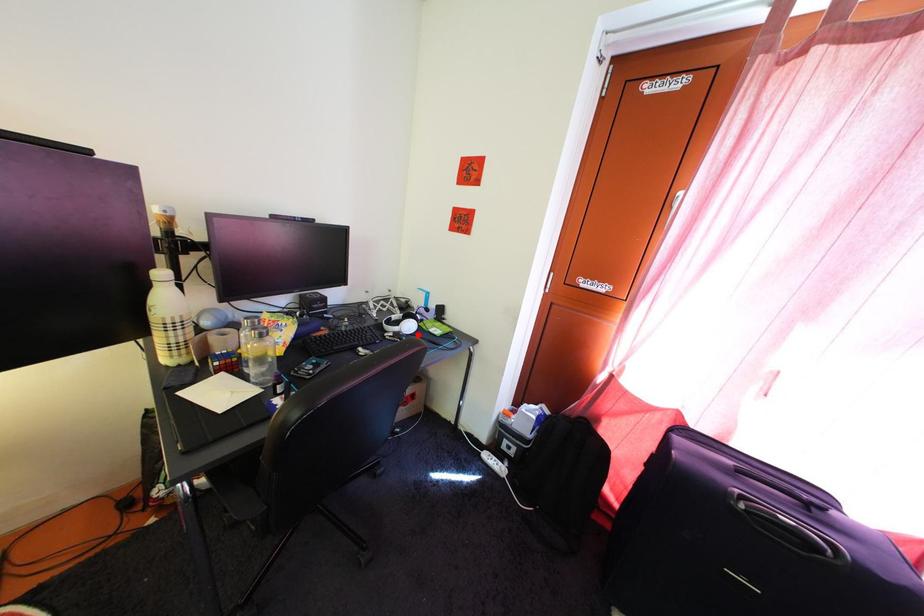
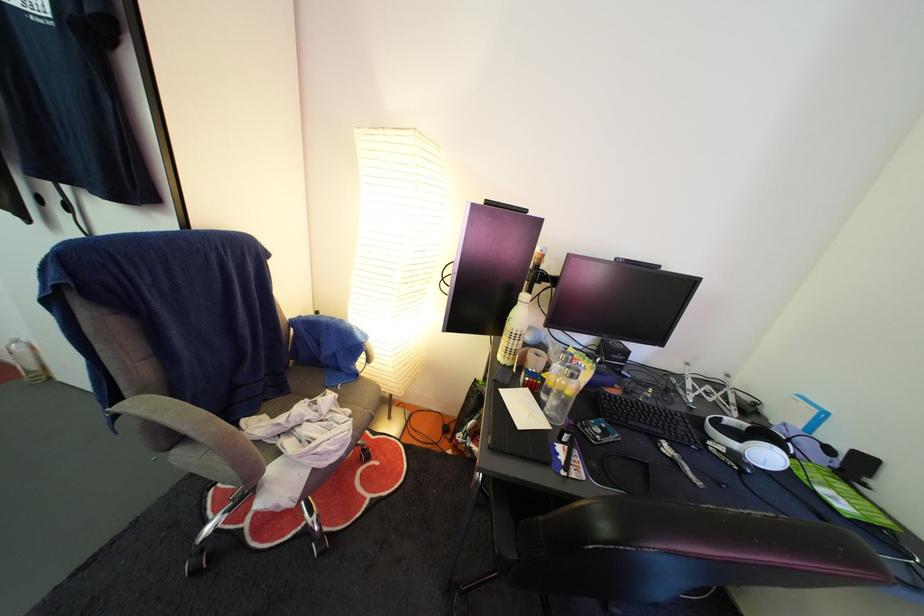
Where in the second image is the point corresponding to the highlighted location from the first image?

(774, 464)